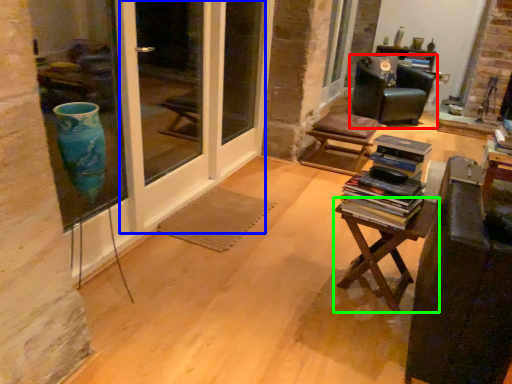
Question: Based on their relative distances, which object is nearer to chair (highlighted by a red box)? Choose from screen door (highlighted by a blue box) and table (highlighted by a green box).

Choices:
 (A) screen door
 (B) table

Answer: (A)